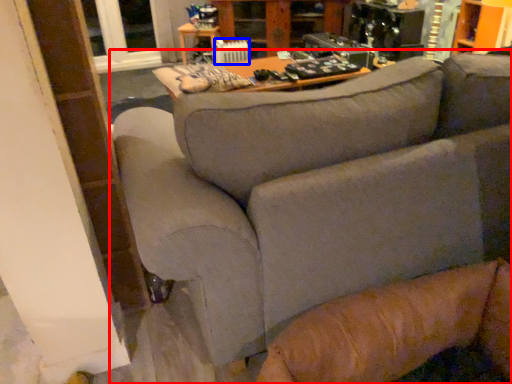
Question: Which of the following is the closest to the observer, studio couch (highlighted by a red box) or radiator (highlighted by a blue box)?

Choices:
 (A) studio couch
 (B) radiator

Answer: (A)